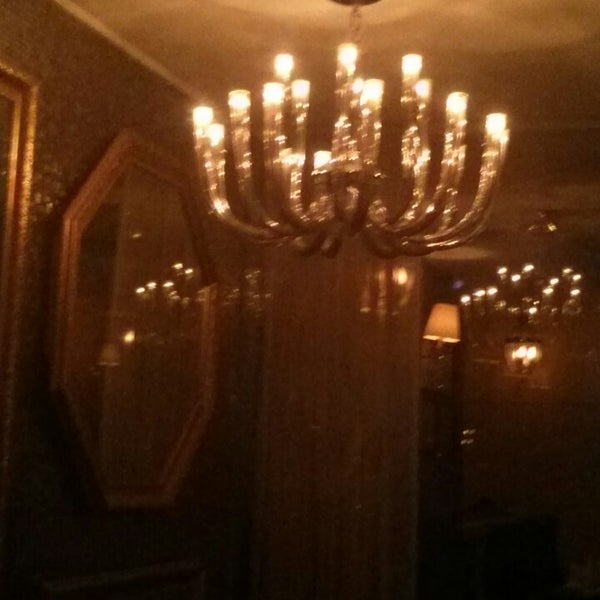
Where is `the right side of mirror`? The height and width of the screenshot is (600, 600). the right side of mirror is located at coordinates coord(209,321).